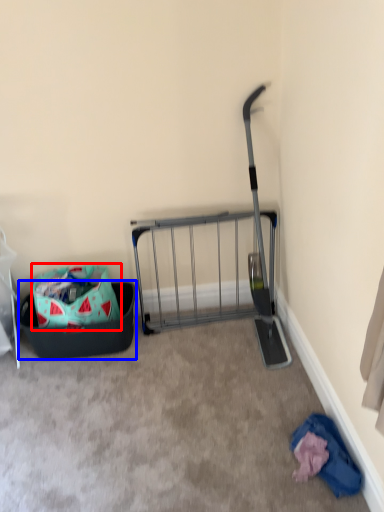
Question: Which object is further to the camera taking this photo, bag (highlighted by a red box) or laundry basket (highlighted by a blue box)?

Choices:
 (A) bag
 (B) laundry basket

Answer: (B)